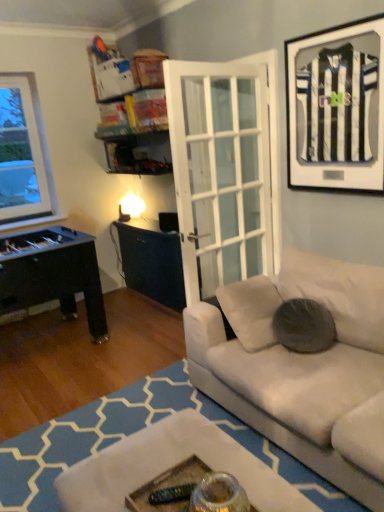
Question: Is dark gray fabric pillow at center at the left side of matte black jersey at upper right?

Choices:
 (A) yes
 (B) no

Answer: (A)

Question: From the image's perspective, is dark gray fabric pillow at center above matte black jersey at upper right?

Choices:
 (A) no
 (B) yes

Answer: (A)

Question: Is dark gray fabric pillow at center far from matte black jersey at upper right?

Choices:
 (A) yes
 (B) no

Answer: (A)

Question: From the image's perspective, is dark gray fabric pillow at center located beneath matte black jersey at upper right?

Choices:
 (A) no
 (B) yes

Answer: (B)

Question: Does dark gray fabric pillow at center come in front of matte black jersey at upper right?

Choices:
 (A) no
 (B) yes

Answer: (A)

Question: Considering the relative sizes of dark gray fabric pillow at center and matte black jersey at upper right in the image provided, is dark gray fabric pillow at center wider than matte black jersey at upper right?

Choices:
 (A) yes
 (B) no

Answer: (A)

Question: Is the position of matte black jersey at upper right less distant than that of dark gray fabric pillow at center?

Choices:
 (A) no
 (B) yes

Answer: (B)

Question: Considering the relative sizes of matte black jersey at upper right and dark gray fabric pillow at center in the image provided, is matte black jersey at upper right smaller than dark gray fabric pillow at center?

Choices:
 (A) yes
 (B) no

Answer: (A)

Question: Does matte black jersey at upper right have a greater width compared to dark gray fabric pillow at center?

Choices:
 (A) yes
 (B) no

Answer: (B)

Question: From a real-world perspective, is matte black jersey at upper right located higher than dark gray fabric pillow at center?

Choices:
 (A) yes
 (B) no

Answer: (A)

Question: Would you consider matte black jersey at upper right to be distant from dark gray fabric pillow at center?

Choices:
 (A) no
 (B) yes

Answer: (B)

Question: Can you confirm if matte black jersey at upper right is positioned to the right of dark gray fabric pillow at center?

Choices:
 (A) no
 (B) yes

Answer: (B)

Question: Visually, is matte black jersey at upper right positioned to the left or to the right of dark gray fabric pillow at center?

Choices:
 (A) right
 (B) left

Answer: (A)